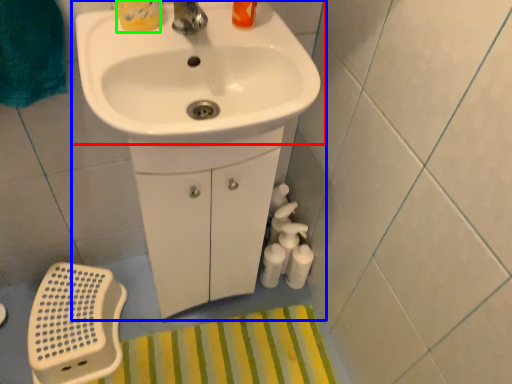
Question: Considering the real-world distances, which object is closest to sink (highlighted by a red box)? sink (highlighted by a blue box) or toiletry (highlighted by a green box).

Choices:
 (A) sink
 (B) toiletry

Answer: (A)